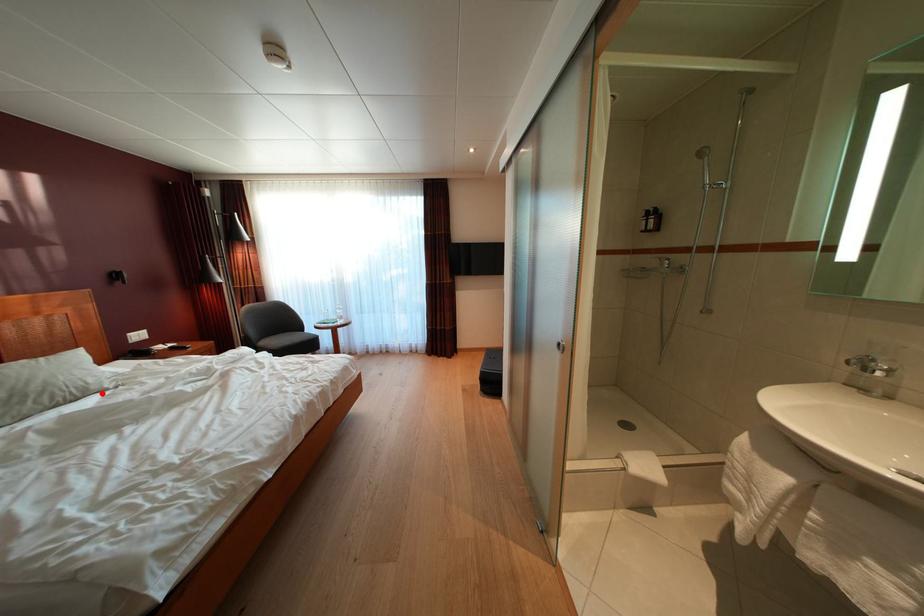
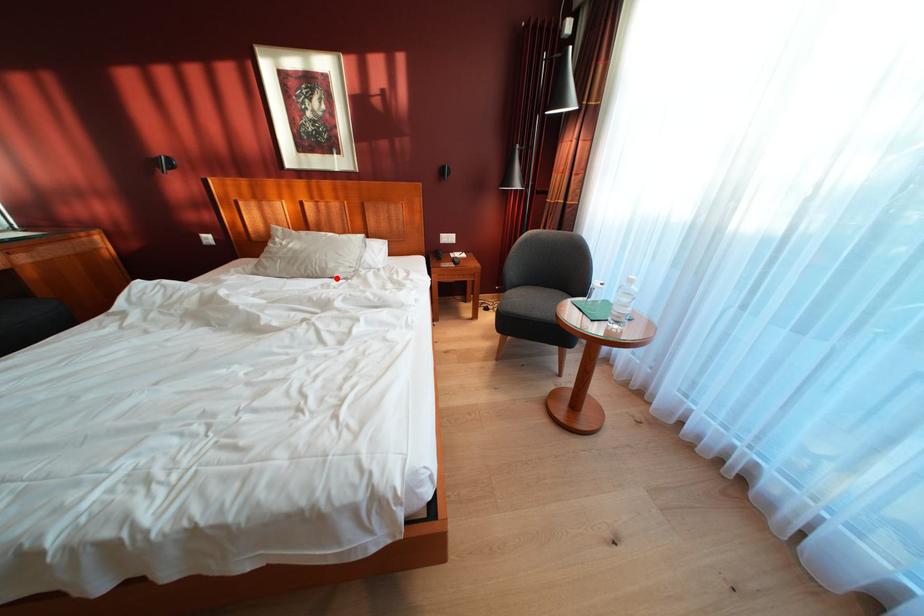
I am providing you with two images of the same scene from different viewpoints. A red point is marked on the first image and another point is marked on the second image. Is the red point in image1 aligned with the point shown in image2?

Yes